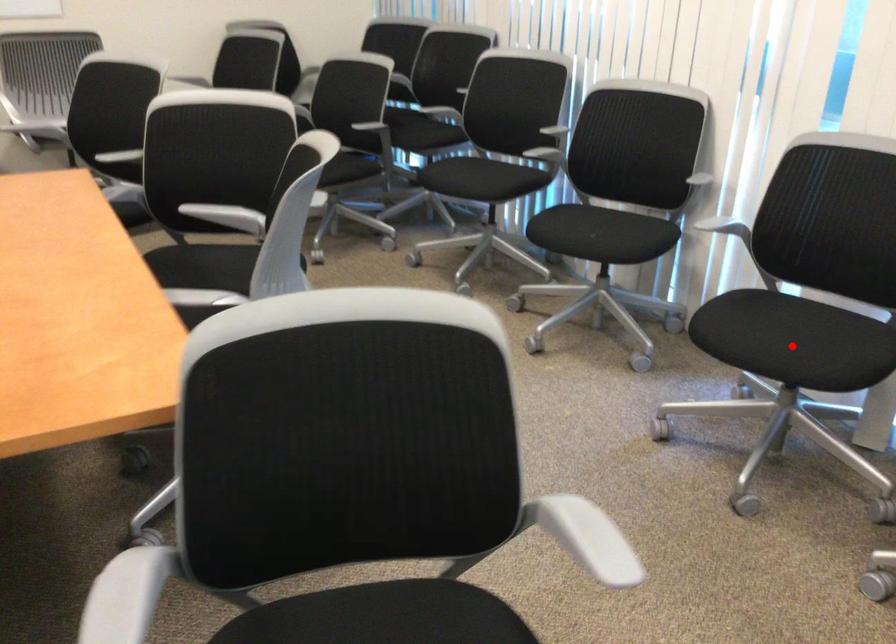
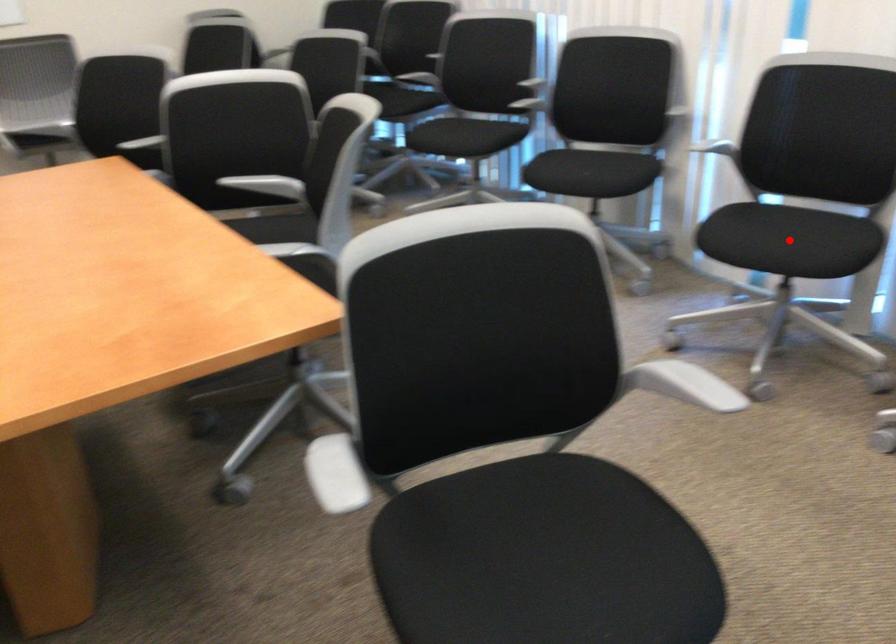
I am providing you with two images of the same scene from different viewpoints. A red point is marked on the first image and another point is marked on the second image. Is the red point in image1 aligned with the point shown in image2?

Yes